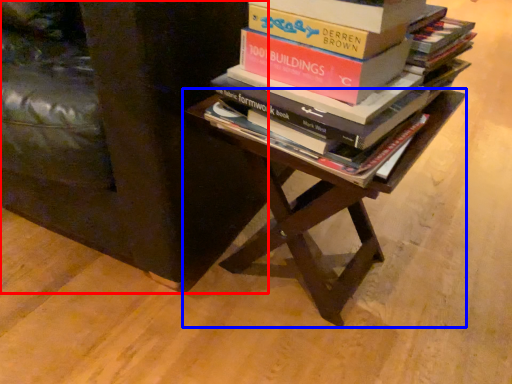
Question: Which point is further to the camera, furniture (highlighted by a red box) or table (highlighted by a blue box)?

Choices:
 (A) furniture
 (B) table

Answer: (B)